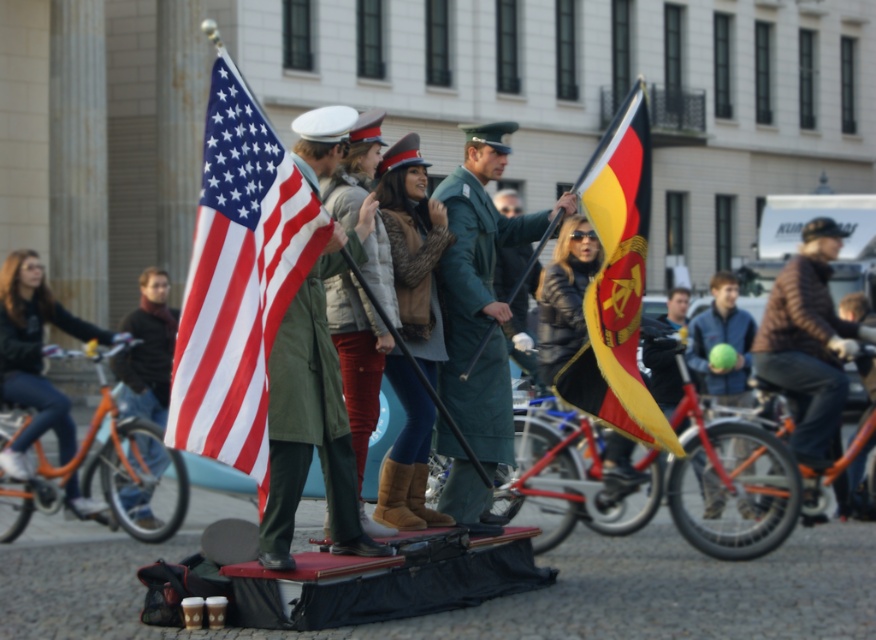
Does red matte bicycle at center appear over green military uniform at center?

Incorrect, red matte bicycle at center is not positioned above green military uniform at center.

Based on the photo, does red matte bicycle at center come behind green military uniform at center?

That is True.

This screenshot has width=876, height=640. I want to click on red matte bicycle at center, so click(x=668, y=481).

Between point (390, 468) and point (759, 500), which one is positioned behind?

The point (759, 500) is more distant.

Identify the location of brown suede boots at center. This screenshot has height=640, width=876. (413, 248).

Looking at this image, which of these two, green military uniform at center or yellow and black fabric flag at center, stands taller?

With more height is yellow and black fabric flag at center.

Is green military uniform at center thinner than yellow and black fabric flag at center?

Yes.

Does point (479, 221) come farther from viewer compared to point (631, 234)?

Yes, it is.

Find the location of `green military uniform at center`. green military uniform at center is located at coordinates (479, 291).